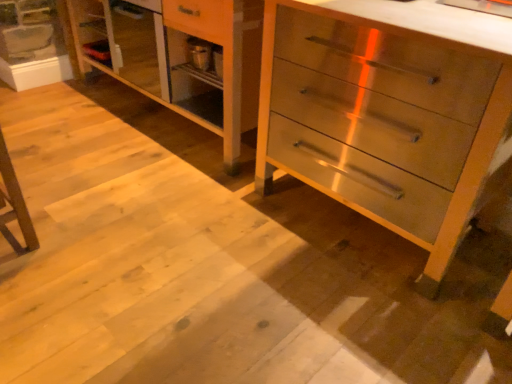
What is the approximate width of metallic silver chest of drawers at center?

The width of metallic silver chest of drawers at center is 66.66 centimeters.

This screenshot has height=384, width=512. What do you see at coordinates (381, 122) in the screenshot?
I see `metallic silver chest of drawers at center` at bounding box center [381, 122].

Measure the distance between metallic silver chest of drawers at center and camera.

metallic silver chest of drawers at center and camera are 3.54 feet apart.

You are a GUI agent. You are given a task and a screenshot of the screen. Output one action in this format:
    pyautogui.click(x=<x>, y=<y>)
    Task: Click on the metallic silver chest of drawers at center
    
    Given the screenshot: What is the action you would take?
    pyautogui.click(x=381, y=122)

Describe the element at coordinates (180, 57) in the screenshot. I see `light wood dresser at center` at that location.

The width and height of the screenshot is (512, 384). I want to click on light wood dresser at center, so click(x=180, y=57).

What is the approximate height of light wood dresser at center?

The height of light wood dresser at center is 33.49 inches.

You are a GUI agent. You are given a task and a screenshot of the screen. Output one action in this format:
    pyautogui.click(x=<x>, y=<y>)
    Task: Click on the metallic silver chest of drawers at center
    
    Given the screenshot: What is the action you would take?
    pyautogui.click(x=381, y=122)

Is light wood dresser at center to the left of metallic silver chest of drawers at center from the viewer's perspective?

Yes, light wood dresser at center is to the left of metallic silver chest of drawers at center.

Which object is further away from the camera taking this photo, light wood dresser at center or metallic silver chest of drawers at center?

light wood dresser at center is behind.

Is point (191, 60) positioned in front of point (475, 151)?

No, (191, 60) is further to viewer.

From the image's perspective, is light wood dresser at center above or below metallic silver chest of drawers at center?

Clearly, from the image's perspective, light wood dresser at center is above metallic silver chest of drawers at center.

From a real-world perspective, which is physically above, light wood dresser at center or metallic silver chest of drawers at center?

metallic silver chest of drawers at center.

Which of these two, light wood dresser at center or metallic silver chest of drawers at center, is thinner?

With smaller width is metallic silver chest of drawers at center.

Considering the relative sizes of light wood dresser at center and metallic silver chest of drawers at center in the image provided, is light wood dresser at center shorter than metallic silver chest of drawers at center?

Correct, light wood dresser at center is not as tall as metallic silver chest of drawers at center.

Is light wood dresser at center bigger than metallic silver chest of drawers at center?

Indeed, light wood dresser at center has a larger size compared to metallic silver chest of drawers at center.

From the picture: Is light wood dresser at center inside or outside of metallic silver chest of drawers at center?

light wood dresser at center is not enclosed by metallic silver chest of drawers at center.

Is light wood dresser at center not near metallic silver chest of drawers at center?

No, there isn't a large distance between light wood dresser at center and metallic silver chest of drawers at center.

Does light wood dresser at center turn towards metallic silver chest of drawers at center?

No, light wood dresser at center does not turn towards metallic silver chest of drawers at center.

What's the angular difference between light wood dresser at center and metallic silver chest of drawers at center's facing directions?

light wood dresser at center and metallic silver chest of drawers at center are facing 0.24 degrees away from each other.

Measure the distance between light wood dresser at center and metallic silver chest of drawers at center.

light wood dresser at center is 25.60 inches from metallic silver chest of drawers at center.

You are a GUI agent. You are given a task and a screenshot of the screen. Output one action in this format:
    pyautogui.click(x=<x>, y=<y>)
    Task: Click on the chest of drawers lying below the light wood dresser at center (from the image's perspective)
    
    Given the screenshot: What is the action you would take?
    pyautogui.click(x=381, y=122)

In the scene shown: Which object is positioned more to the left, metallic silver chest of drawers at center or light wood dresser at center?

From the viewer's perspective, light wood dresser at center appears more on the left side.

Which object is more forward, metallic silver chest of drawers at center or light wood dresser at center?

metallic silver chest of drawers at center.

Does point (406, 158) come farther from viewer compared to point (173, 34)?

No, (406, 158) is in front of (173, 34).

From the image's perspective, is metallic silver chest of drawers at center located above or below light wood dresser at center?

From the image's perspective, metallic silver chest of drawers at center appears below light wood dresser at center.

From a real-world perspective, is metallic silver chest of drawers at center over light wood dresser at center?

Correct, in the physical world, metallic silver chest of drawers at center is higher than light wood dresser at center.

Considering the sizes of metallic silver chest of drawers at center and light wood dresser at center in the image, is metallic silver chest of drawers at center wider or thinner than light wood dresser at center?

Clearly, metallic silver chest of drawers at center has less width compared to light wood dresser at center.

Considering the sizes of metallic silver chest of drawers at center and light wood dresser at center in the image, is metallic silver chest of drawers at center taller or shorter than light wood dresser at center?

Clearly, metallic silver chest of drawers at center is taller compared to light wood dresser at center.

Is metallic silver chest of drawers at center bigger than light wood dresser at center?

No.

Is light wood dresser at center located within metallic silver chest of drawers at center?

No.

From the picture: Is metallic silver chest of drawers at center with light wood dresser at center?

No, metallic silver chest of drawers at center is not next to light wood dresser at center.

Is metallic silver chest of drawers at center oriented away from light wood dresser at center?

No, metallic silver chest of drawers at center is not facing away from light wood dresser at center.

What's the angular difference between metallic silver chest of drawers at center and light wood dresser at center's facing directions?

metallic silver chest of drawers at center and light wood dresser at center are facing 0.24 degrees away from each other.

The image size is (512, 384). Identify the location of dresser above the metallic silver chest of drawers at center (from the image's perspective). (180, 57).

The width and height of the screenshot is (512, 384). In order to click on dresser on the left of metallic silver chest of drawers at center in this screenshot , I will do pyautogui.click(x=180, y=57).

Identify the location of chest of drawers above the light wood dresser at center (from a real-world perspective). The height and width of the screenshot is (384, 512). (381, 122).